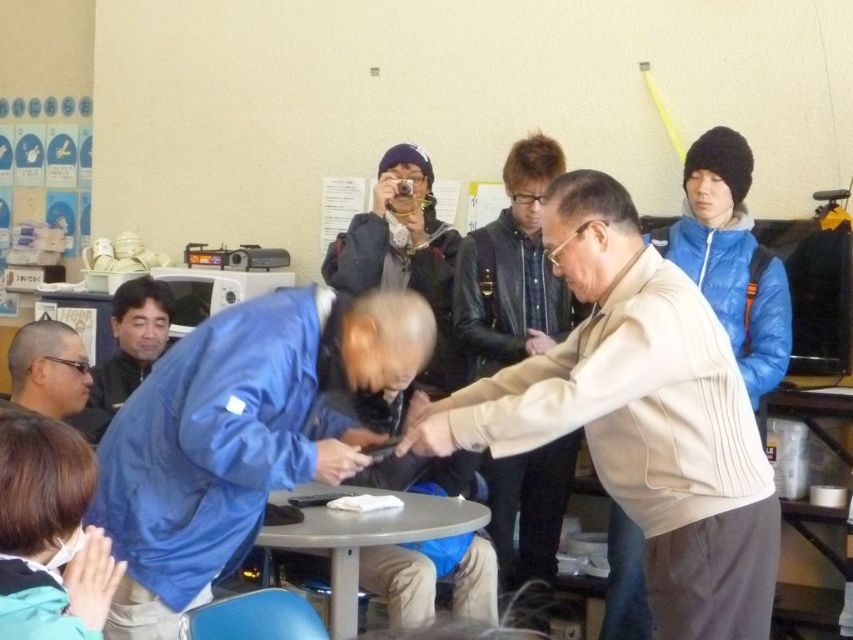
Is point (345, 557) more distant than point (344, 476)?

Yes, it is behind point (344, 476).

Looking at this image, who is shorter, gray plastic table at center or matte blue glove at lower center?

matte blue glove at lower center is shorter.

Where is `gray plastic table at center`? gray plastic table at center is located at coordinates (361, 544).

Locate an element on the screen. This screenshot has width=853, height=640. gray plastic table at center is located at coordinates (361, 544).

Between point (577, 385) and point (80, 595), which one is positioned in front?

Point (80, 595)

Can you confirm if beige fabric jacket at center is positioned above smooth blue fabric at lower left?

Yes.

Does point (570, 225) lie in front of point (105, 554)?

No.

Where is `beige fabric jacket at center`? beige fabric jacket at center is located at coordinates (639, 417).

Is the position of beige fabric jacket at center more distant than that of matte black jacket at center?

No, beige fabric jacket at center is in front of matte black jacket at center.

Who is taller, beige fabric jacket at center or matte black jacket at center?

Standing taller between the two is beige fabric jacket at center.

The width and height of the screenshot is (853, 640). Describe the element at coordinates (639, 417) in the screenshot. I see `beige fabric jacket at center` at that location.

Identify the location of beige fabric jacket at center. This screenshot has height=640, width=853. (639, 417).